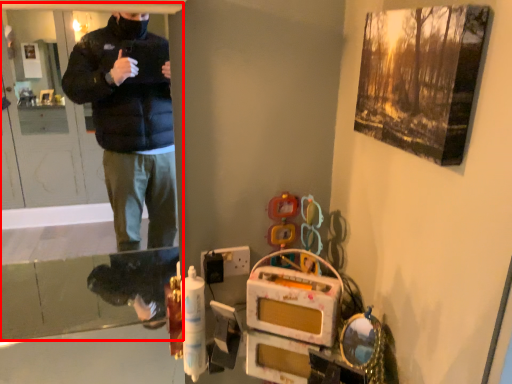
Question: Considering the relative positions of screen door (annotated by the red box) and switch in the image provided, where is screen door (annotated by the red box) located with respect to the staircase?

Choices:
 (A) right
 (B) left

Answer: (B)